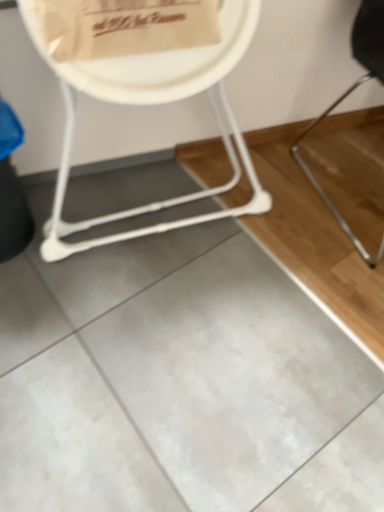
Question: Does white plastic chair at upper left, the 2th chair in the right-to-left sequence, appear on the right side of white paper plate at upper center?

Choices:
 (A) no
 (B) yes

Answer: (A)

Question: Can you confirm if white plastic chair at upper left, which is counted as the 1th chair, starting from the left, is taller than white paper plate at upper center?

Choices:
 (A) yes
 (B) no

Answer: (A)

Question: Considering the relative sizes of white plastic chair at upper left, the 2th chair in the right-to-left sequence, and white paper plate at upper center in the image provided, is white plastic chair at upper left, the 2th chair in the right-to-left sequence, thinner than white paper plate at upper center?

Choices:
 (A) yes
 (B) no

Answer: (B)

Question: From a real-world perspective, is white plastic chair at upper left, the 2th chair in the right-to-left sequence, positioned under white paper plate at upper center based on gravity?

Choices:
 (A) no
 (B) yes

Answer: (B)

Question: Does white plastic chair at upper left, which is counted as the 1th chair, starting from the left, have a smaller size compared to white paper plate at upper center?

Choices:
 (A) no
 (B) yes

Answer: (A)

Question: Is white plastic chair at upper left, which is counted as the 1th chair, starting from the left, bigger or smaller than white paper plate at upper center?

Choices:
 (A) small
 (B) big

Answer: (B)

Question: Visually, is white plastic chair at upper left, which is counted as the 1th chair, starting from the left, positioned to the left or to the right of white paper plate at upper center?

Choices:
 (A) left
 (B) right

Answer: (A)

Question: From the image's perspective, relative to white paper plate at upper center, is white plastic chair at upper left, the 2th chair in the right-to-left sequence, above or below?

Choices:
 (A) below
 (B) above

Answer: (A)

Question: From a real-world perspective, is white plastic chair at upper left, the 2th chair in the right-to-left sequence, physically located above or below white paper plate at upper center?

Choices:
 (A) above
 (B) below

Answer: (B)

Question: Based on their sizes in the image, would you say white paper plate at upper center is bigger or smaller than black metal chair at right, the 2th chair positioned from the left?

Choices:
 (A) big
 (B) small

Answer: (B)

Question: Considering the positions of white paper plate at upper center and black metal chair at right, the 1th chair positioned from the right, in the image, is white paper plate at upper center taller or shorter than black metal chair at right, the 1th chair positioned from the right,?

Choices:
 (A) tall
 (B) short

Answer: (B)

Question: Do you think white paper plate at upper center is within black metal chair at right, the 2th chair positioned from the left, or outside of it?

Choices:
 (A) outside
 (B) inside

Answer: (A)

Question: Considering the relative positions of white paper plate at upper center and black metal chair at right, the 1th chair positioned from the right, in the image provided, is white paper plate at upper center to the left or to the right of black metal chair at right, the 1th chair positioned from the right,?

Choices:
 (A) right
 (B) left

Answer: (B)

Question: Is point (223, 27) closer or farther from the camera than point (367, 75)?

Choices:
 (A) closer
 (B) farther

Answer: (A)

Question: Would you say white plastic chair at upper left, the 2th chair in the right-to-left sequence, is to the left or to the right of black metal chair at right, the 2th chair positioned from the left, in the picture?

Choices:
 (A) left
 (B) right

Answer: (A)